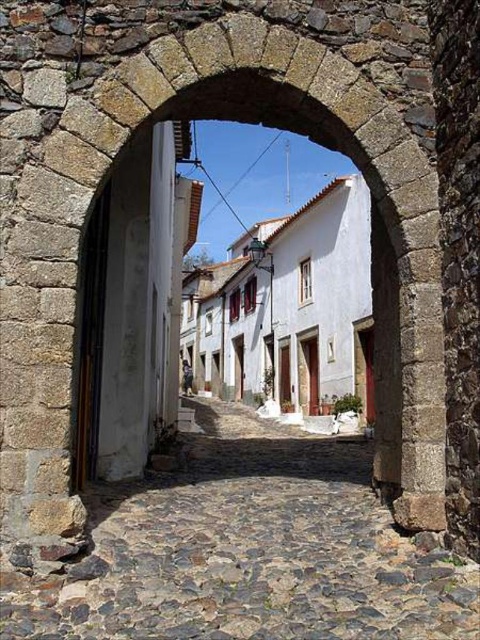
You are a tourist standing in front of the stone archway. You want to walk towards the cobblestone path at center. Which direction should you look to see the white smooth building at center above the path?

The cobblestone path at center is positioned under the white smooth building at center, so you should look upward to see the white smooth building at center above the path.

You are a tourist standing at the entrance of the stone archway and want to walk to the white smooth building at center. Which direction should you go relative to the cobblestone path at center?

The cobblestone path at center leads directly to the white smooth building at center. Since the cobblestone path at center is shorter than the white smooth building at center, you should follow the cobblestone path at center towards the building to reach it.

You are standing at the entrance of the stone archway and want to walk to the cobblestone path at center. According to the coordinates provided, in which direction should you move relative to the archway to reach it?

The cobblestone path at center is located at coordinates point (250, 550), so you should move forward and slightly to the right relative to the archway to reach it.